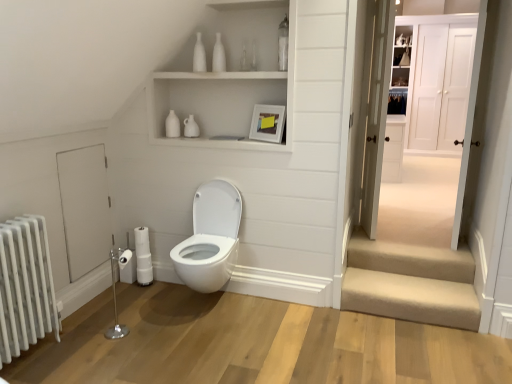
Question: Is white marble radiator at left in front of or behind white wooden door at upper right, the third door in the left-to-right sequence, in the image?

Choices:
 (A) behind
 (B) front

Answer: (B)

Question: Based on their positions, is white marble radiator at left located to the left or right of white wooden door at upper right, positioned as the second door in right-to-left order?

Choices:
 (A) left
 (B) right

Answer: (A)

Question: Which object is the closest to the white wooden door at upper right, the third door in the left-to-right sequence?

Choices:
 (A) white glossy door at right, which is counted as the second door, starting from the front
 (B) white matte toilet paper at lower left
 (C) beige carpeted stairs at lower right
 (D) white marble radiator at left
 (E) white wood door at upper right, which is the first door from back to front

Answer: (E)

Question: Based on their relative distances, which object is nearer to the white wooden door at upper right, the third door in the left-to-right sequence?

Choices:
 (A) white wood door at upper right, which is the first door from back to front
 (B) white marble radiator at left
 (C) white matte toilet paper at lower left
 (D) beige carpeted stairs at lower right
 (E) white glossy door at right, the third door positioned from the right

Answer: (A)